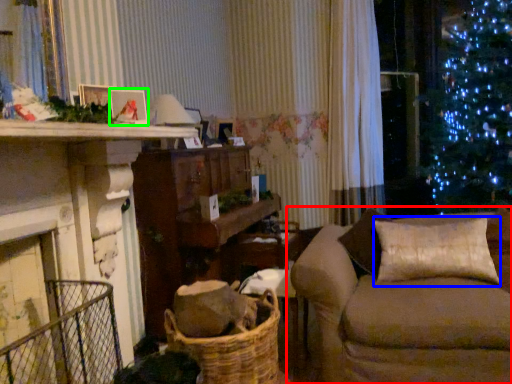
Question: Estimate the real-world distances between objects in this image. Which object is farther from studio couch (highlighted by a red box), pillow (highlighted by a blue box) or picture frame (highlighted by a green box)?

Choices:
 (A) pillow
 (B) picture frame

Answer: (B)